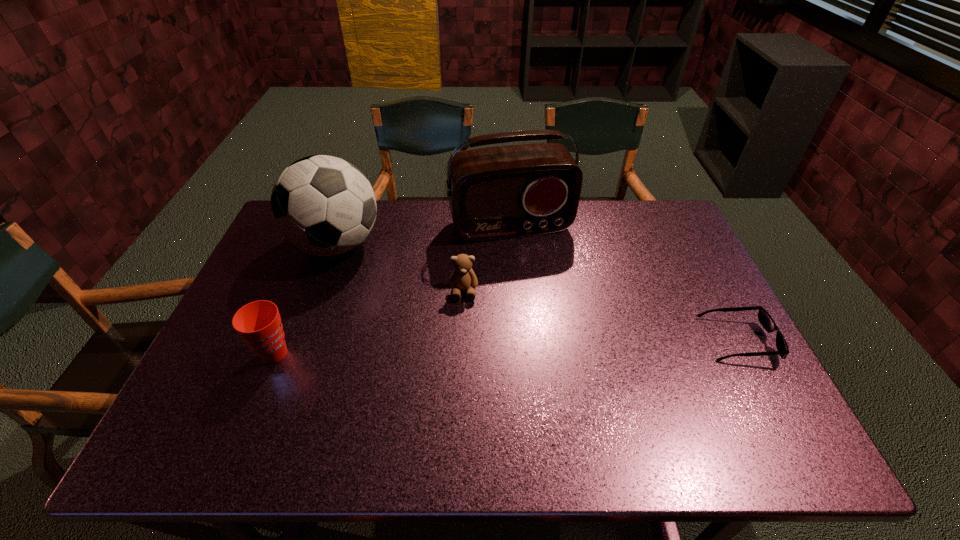
You are a GUI agent. You are given a task and a screenshot of the screen. Output one action in this format:
    pyautogui.click(x=<x>, y=<y>)
    Task: Click on the third shortest object
    The height and width of the screenshot is (540, 960).
    Given the screenshot: What is the action you would take?
    pyautogui.click(x=259, y=323)

Where is `the rightmost object`? Image resolution: width=960 pixels, height=540 pixels. the rightmost object is located at coordinates pos(765,319).

The image size is (960, 540). I want to click on the shortest object, so click(765, 319).

Where is `soccer ball`? This screenshot has height=540, width=960. soccer ball is located at coordinates (322, 205).

Identify the location of radio receiver. coord(501,192).

Where is `teddy bear`? teddy bear is located at coordinates (463, 277).

Locate an element on the screen. This screenshot has height=540, width=960. the second shortest object is located at coordinates (463, 277).

You are a GUI agent. You are given a task and a screenshot of the screen. Output one action in this format:
    pyautogui.click(x=<x>, y=<y>)
    Task: Click on the vacant space situated on the back of the third tallest object
    Image resolution: width=960 pixels, height=540 pixels.
    Given the screenshot: What is the action you would take?
    pyautogui.click(x=300, y=291)

Find the location of `free space located 0.170m on the main logo of the soccer ball`. free space located 0.170m on the main logo of the soccer ball is located at coordinates (396, 298).

Identify the location of free region located 0.260m on the main logo of the soccer ball. (416, 315).